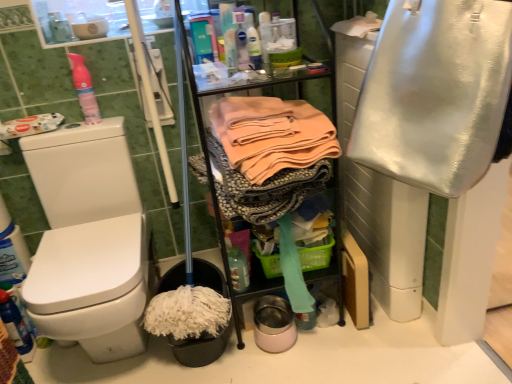
Question: From a real-world perspective, is soft peach fabric at center, which ranks as the second clothing in right-to-left order, above or below translucent plastic bottle at center?

Choices:
 (A) below
 (B) above

Answer: (B)

Question: Relative to translucent plastic bottle at center, is soft peach fabric at center, the first clothing viewed from the left, in front or behind?

Choices:
 (A) behind
 (B) front

Answer: (B)

Question: Which is farther from the pink matte spray can at upper left?

Choices:
 (A) green plastic basket at center
 (B) translucent plastic bottle at center
 (C) soft peach fabric at center, the first clothing viewed from the left
 (D) shiny metallic bag at right, acting as the 2th clothing starting from the left

Answer: (D)

Question: Which of these objects is positioned farthest from the shiny metallic bag at right, acting as the 2th clothing starting from the left?

Choices:
 (A) green plastic basket at center
 (B) translucent plastic bottle at center
 (C) soft peach fabric at center, which ranks as the second clothing in right-to-left order
 (D) pink matte spray can at upper left

Answer: (D)